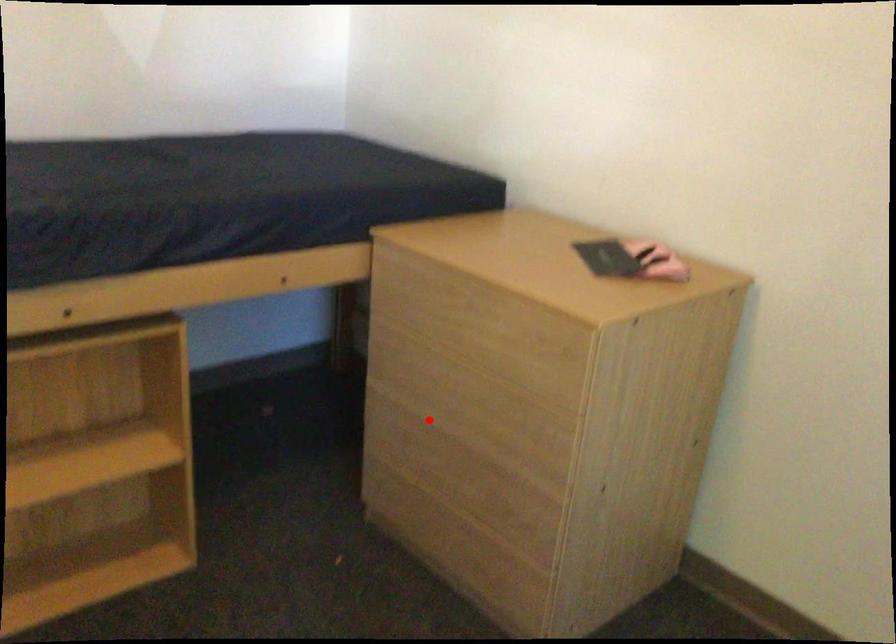
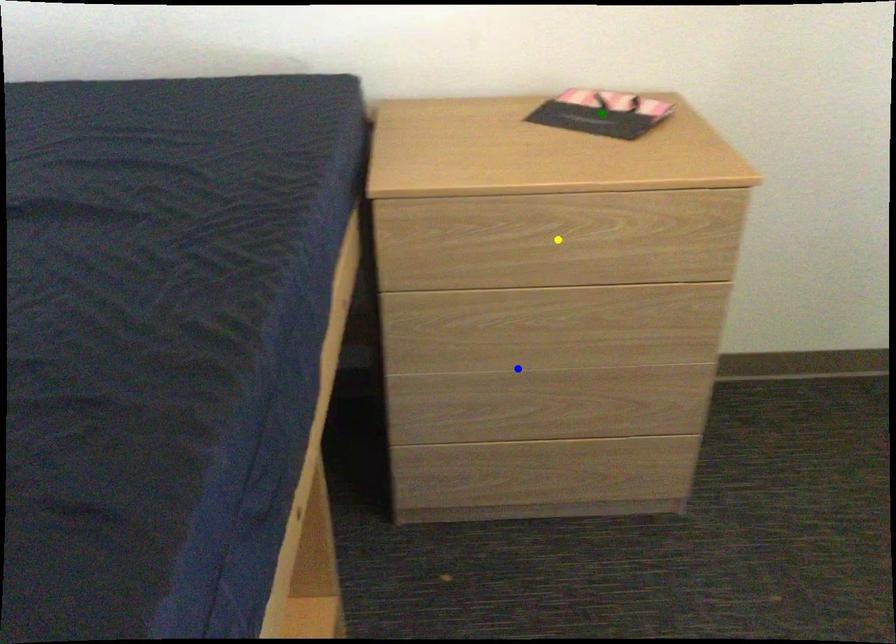
Question: I am providing you with two images of the same scene from different viewpoints. A red point is marked on the first image. You are given multiple points on the second image. Can you choose the point in image 2 that corresponds to the point in image 1?

Choices:
 (A) green point
 (B) yellow point
 (C) blue point

Answer: (C)